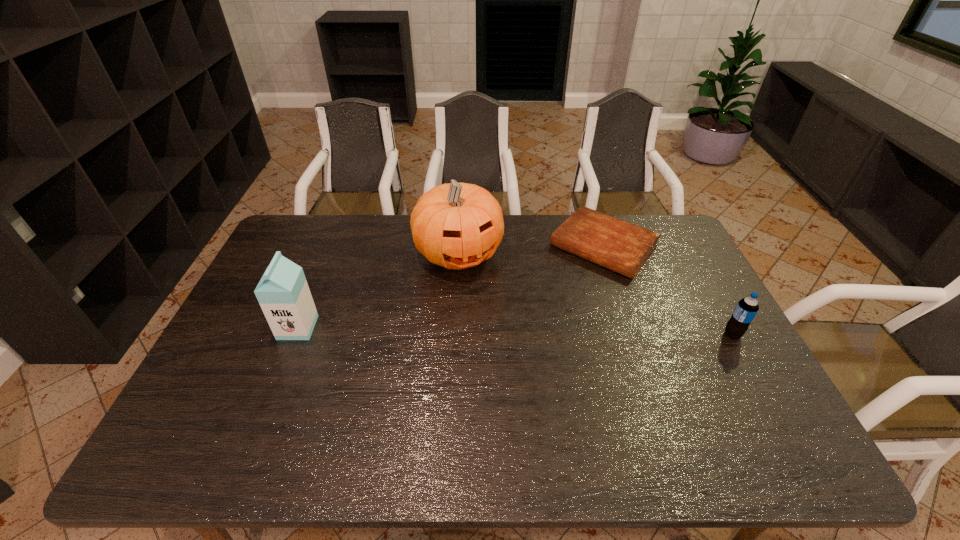
The height and width of the screenshot is (540, 960). Identify the location of vacant space on the desktop that is between the milk carton and the rightmost object and is positioned on the spine side of the Bible. (529, 331).

At what (x,y) coordinates should I click in order to perform the action: click on free space on the desktop that is between the milk carton and the second shortest object and is positioned on the front-facing side of the tallest object. Please return your answer as a coordinate pair (x, y). Looking at the image, I should click on (502, 331).